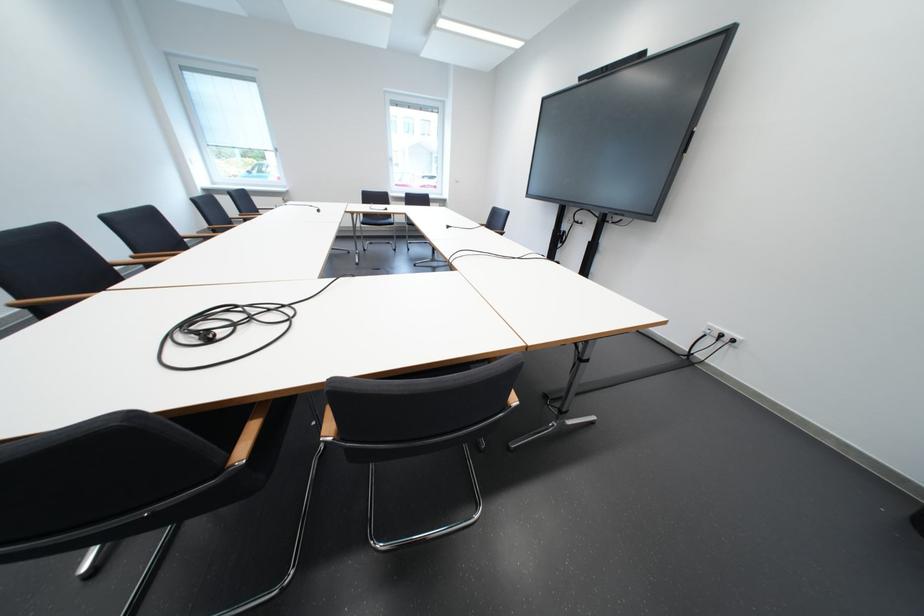
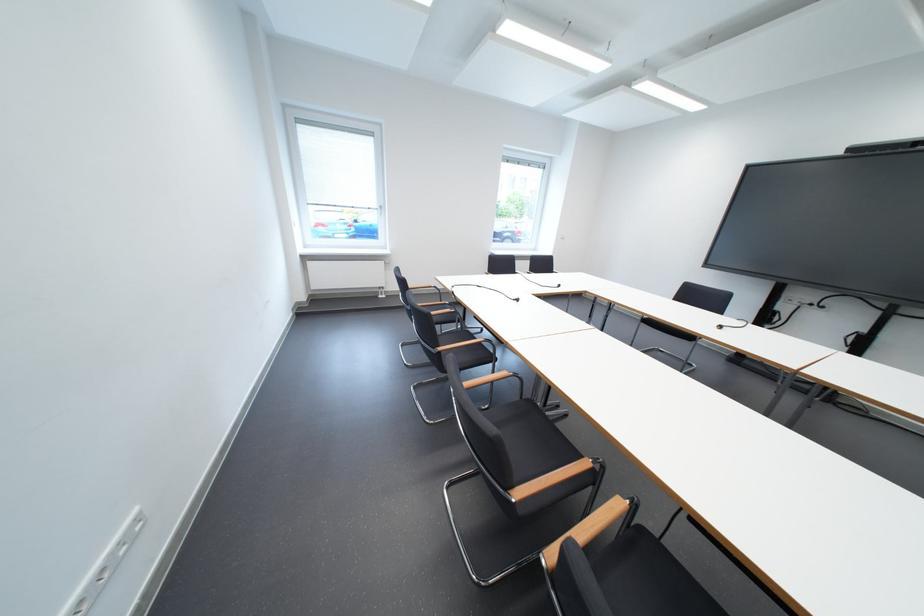
Question: In a continuous first-person perspective shot, in which direction is the camera moving?

Choices:
 (A) Left
 (B) Right
 (C) Forward
 (D) Backward

Answer: (A)